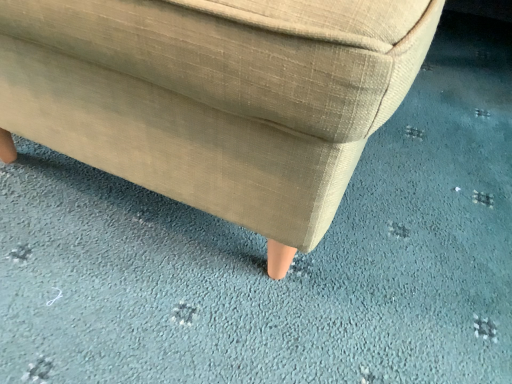
Where is `beige fabric couch at center`? beige fabric couch at center is located at coordinates 215,97.

Measure the distance between point (x=345, y=139) and camera.

12.09 inches.

What do you see at coordinates (215, 97) in the screenshot? I see `beige fabric couch at center` at bounding box center [215, 97].

The image size is (512, 384). I want to click on beige fabric couch at center, so click(x=215, y=97).